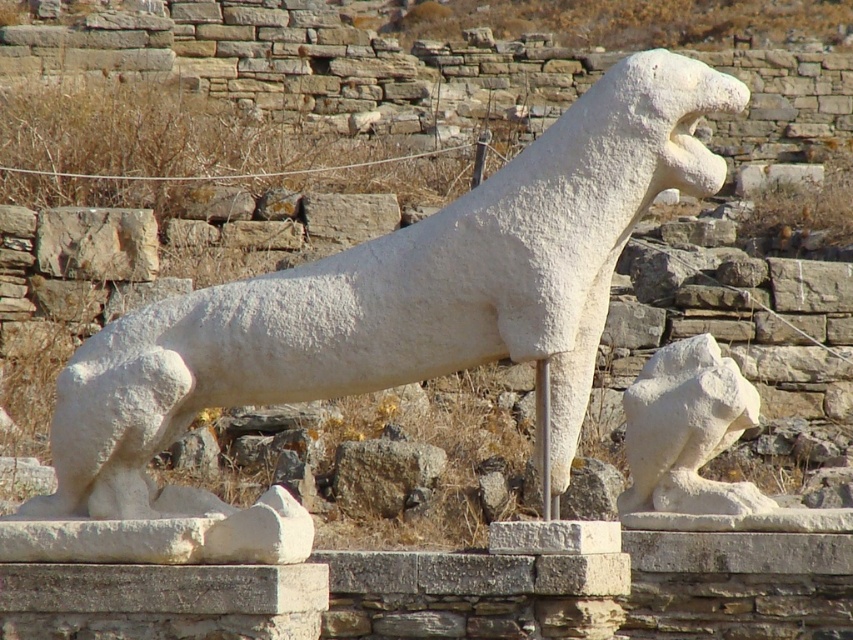
Is white marble dog at center wider than white stone lion at lower right?

Correct, the width of white marble dog at center exceeds that of white stone lion at lower right.

Consider the image. Is white marble dog at center above white stone lion at lower right?

Correct, white marble dog at center is located above white stone lion at lower right.

The height and width of the screenshot is (640, 853). What do you see at coordinates (402, 296) in the screenshot?
I see `white marble dog at center` at bounding box center [402, 296].

Where is `white marble dog at center`? The image size is (853, 640). white marble dog at center is located at coordinates (402, 296).